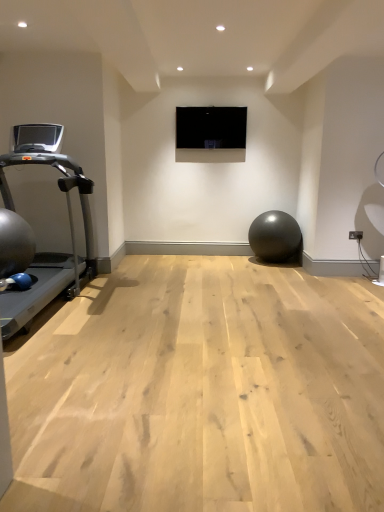
Describe the element at coordinates (275, 237) in the screenshot. I see `matte black ball at center` at that location.

What are the coordinates of `matte black ball at center` in the screenshot? It's located at (275, 237).

This screenshot has height=512, width=384. I want to click on silver metallic treadmill at left, so click(69, 223).

Identify the location of black glossy screen at center. (211, 127).

What is the approximate height of black glossy screen at center?

The height of black glossy screen at center is 21.11 inches.

Image resolution: width=384 pixels, height=512 pixels. I want to click on matte black ball at center, so click(275, 237).

From a real-world perspective, is matte black ball at center under silver metallic treadmill at left?

Correct, in the physical world, matte black ball at center is lower than silver metallic treadmill at left.

Does matte black ball at center turn towards silver metallic treadmill at left?

No, matte black ball at center is not aimed at silver metallic treadmill at left.

In order to click on treadmill located above the matte black ball at center (from the image's perspective) in this screenshot , I will do `click(69, 223)`.

How different are the orientations of black glossy screen at center and silver metallic treadmill at left in degrees?

There is a 90.9-degree angle between the facing directions of black glossy screen at center and silver metallic treadmill at left.

This screenshot has height=512, width=384. In order to click on projection screen above the silver metallic treadmill at left (from a real-world perspective) in this screenshot , I will do `click(211, 127)`.

From a real-world perspective, is black glossy screen at center physically located above or below silver metallic treadmill at left?

black glossy screen at center is situated higher than silver metallic treadmill at left in the real world.

From their relative heights in the image, would you say matte black ball at center is taller or shorter than black glossy screen at center?

Clearly, matte black ball at center is taller compared to black glossy screen at center.

Does point (288, 244) come in front of point (194, 127)?

Yes, it is in front of point (194, 127).

Which object is further away from the camera taking this photo, matte black ball at center or black glossy screen at center?

black glossy screen at center.

Is the surface of silver metallic treadmill at left in direct contact with black glossy screen at center?

No, silver metallic treadmill at left is not next to black glossy screen at center.

Which point is more distant from viewer, [53,128] or [226,135]?

Point [226,135]

Locate an element on the screen. The height and width of the screenshot is (512, 384). treadmill below the black glossy screen at center (from a real-world perspective) is located at coordinates (69, 223).

How much distance is there between silver metallic treadmill at left and black glossy screen at center?

silver metallic treadmill at left is 6.76 feet from black glossy screen at center.

Are silver metallic treadmill at left and matte black ball at center located far from each other?

Yes, silver metallic treadmill at left and matte black ball at center are located far from each other.

Is silver metallic treadmill at left taller than matte black ball at center?

Indeed, silver metallic treadmill at left has a greater height compared to matte black ball at center.

Is point (68, 166) behind point (284, 212)?

No, (68, 166) is closer to viewer.

Can matte black ball at center be found inside silver metallic treadmill at left?

No, matte black ball at center is not inside silver metallic treadmill at left.

From a real-world perspective, is black glossy screen at center positioned above or below matte black ball at center?

From a real-world perspective, black glossy screen at center is physically above matte black ball at center.

From the image's perspective, does black glossy screen at center appear lower than matte black ball at center?

No, from the image's perspective, black glossy screen at center is not beneath matte black ball at center.

At what (x,y) coordinates should I click in order to perform the action: click on ball lying behind the silver metallic treadmill at left. Please return your answer as a coordinate pair (x, y). Looking at the image, I should click on (275, 237).

Identify the location of projection screen on the right of the silver metallic treadmill at left. The image size is (384, 512). (211, 127).

Looking at the image, which one is located closer to black glossy screen at center, matte black ball at center or silver metallic treadmill at left?

matte black ball at center.

Based on their spatial positions, is black glossy screen at center or silver metallic treadmill at left closer to matte black ball at center?

black glossy screen at center.

From the image, which object appears to be farther from silver metallic treadmill at left, black glossy screen at center or matte black ball at center?

Among the two, matte black ball at center is located further to silver metallic treadmill at left.

Considering their positions, is matte black ball at center positioned further to silver metallic treadmill at left than black glossy screen at center?

matte black ball at center.

Based on their spatial positions, is silver metallic treadmill at left or black glossy screen at center further from matte black ball at center?

The object further to matte black ball at center is silver metallic treadmill at left.

From the image, which object appears to be nearer to black glossy screen at center, silver metallic treadmill at left or matte black ball at center?

matte black ball at center.

Identify the location of ball between silver metallic treadmill at left and black glossy screen at center in the front-back direction. (275, 237).